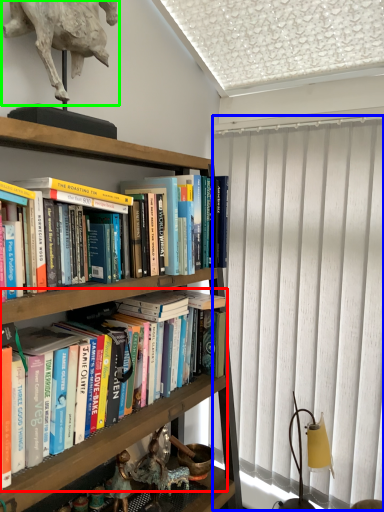
Question: Considering the real-world distances, which object is closest to book (highlighted by a red box)? curtain (highlighted by a blue box) or animal (highlighted by a green box).

Choices:
 (A) curtain
 (B) animal

Answer: (A)